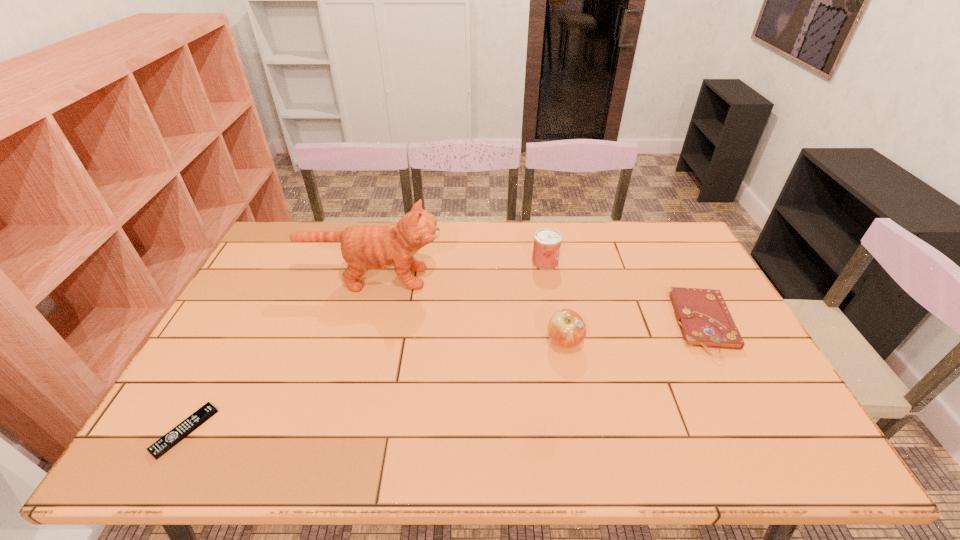
Identify the location of object that stands as the closest to the can. (566, 328).

Image resolution: width=960 pixels, height=540 pixels. I want to click on the third closest object to the can, so click(x=704, y=319).

Locate an element on the screen. This screenshot has height=540, width=960. free space in the image that satisfies the following two spatial constraints: 1. on the back side of the remote control; 2. on the right side of the second shortest object is located at coordinates (243, 325).

Where is `free region that satisfies the following two spatial constraints: 1. on the front side of the can; 2. on the face of the tallest object`? The height and width of the screenshot is (540, 960). free region that satisfies the following two spatial constraints: 1. on the front side of the can; 2. on the face of the tallest object is located at coordinates (548, 278).

I want to click on vacant space that satisfies the following two spatial constraints: 1. on the front side of the can; 2. on the face of the cat, so click(x=548, y=278).

You are a GUI agent. You are given a task and a screenshot of the screen. Output one action in this format:
    pyautogui.click(x=<x>, y=<y>)
    Task: Click on the vacant area in the image that satisfies the following two spatial constraints: 1. on the face of the fourth object from right to left; 2. on the back side of the apple
    The width and height of the screenshot is (960, 540).
    Given the screenshot: What is the action you would take?
    (356, 342)

Image resolution: width=960 pixels, height=540 pixels. I want to click on free space that satisfies the following two spatial constraints: 1. on the face of the rightmost object; 2. on the left side of the tallest object, so click(361, 325).

Identify the location of vacant region that satisfies the following two spatial constraints: 1. on the front side of the can; 2. on the left side of the apple. (559, 342).

The height and width of the screenshot is (540, 960). I want to click on vacant space that satisfies the following two spatial constraints: 1. on the back side of the fourth tallest object; 2. on the right side of the shortest object, so click(243, 325).

Where is `vacant area that satisfies the following two spatial constraints: 1. on the face of the fourth tallest object; 2. on the right side of the cat`? Image resolution: width=960 pixels, height=540 pixels. vacant area that satisfies the following two spatial constraints: 1. on the face of the fourth tallest object; 2. on the right side of the cat is located at coordinates (361, 325).